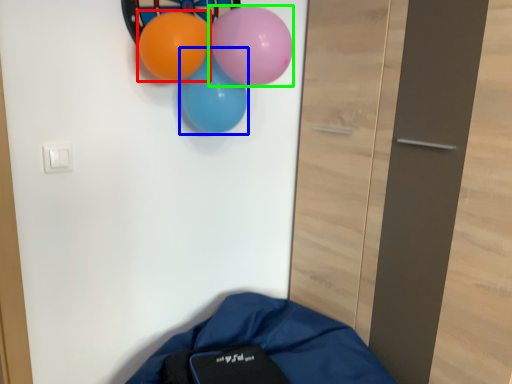
Question: Which is farther away from balloon (highlighted by a red box)? balloon (highlighted by a blue box) or balloon (highlighted by a green box)?

Choices:
 (A) balloon
 (B) balloon

Answer: (B)